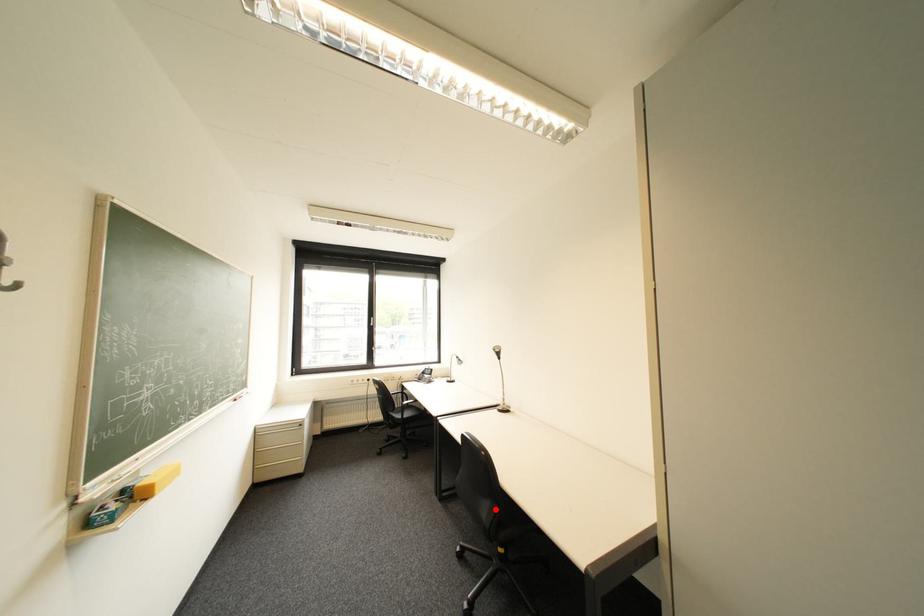
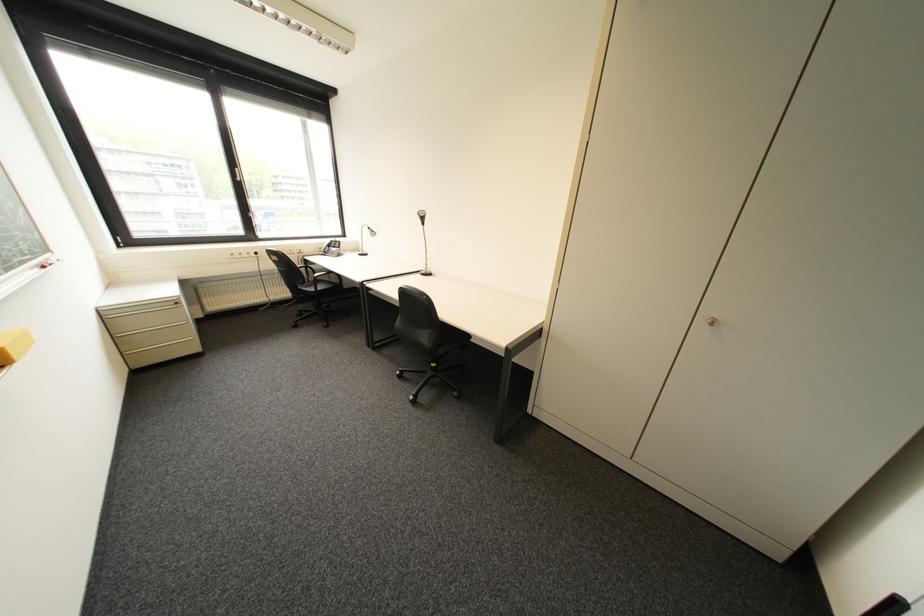
Question: I am providing you with two images of the same scene from different viewpoints. A red point is shown in image1. For the corresponding object point in image2, is it positioned nearer or farther from the camera?

Choices:
 (A) Nearer
 (B) Farther

Answer: (A)